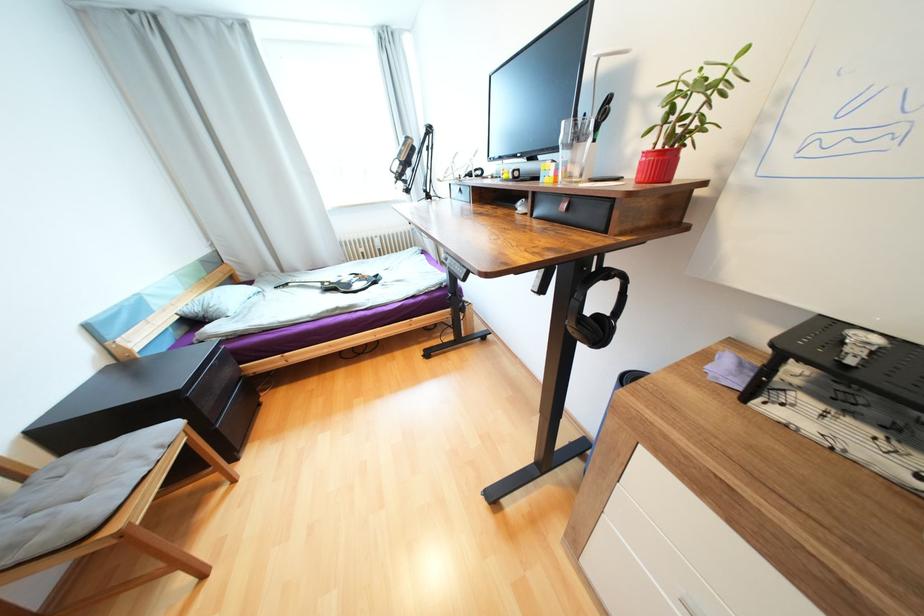
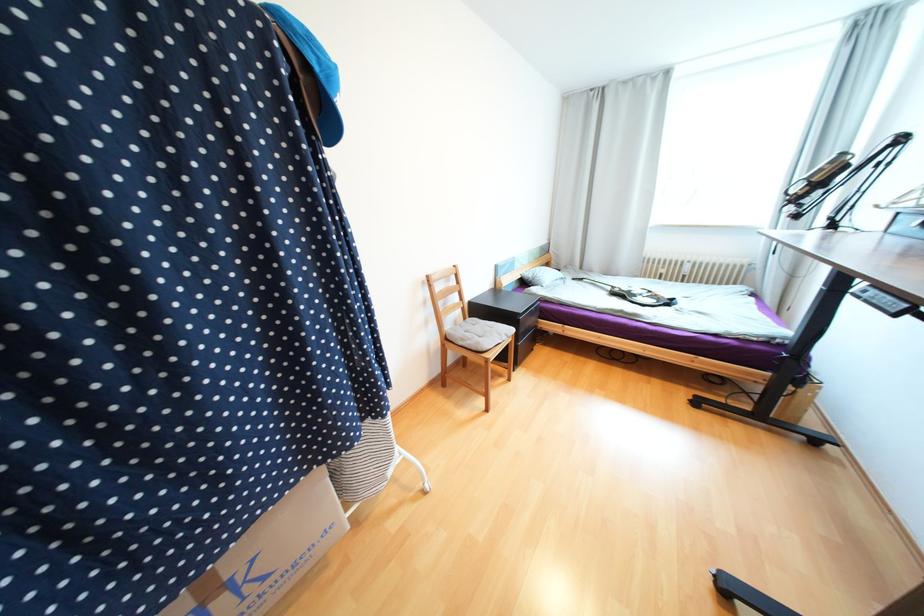
In the second image, find the point that corresponds to (x=325, y=285) in the first image.

(614, 288)